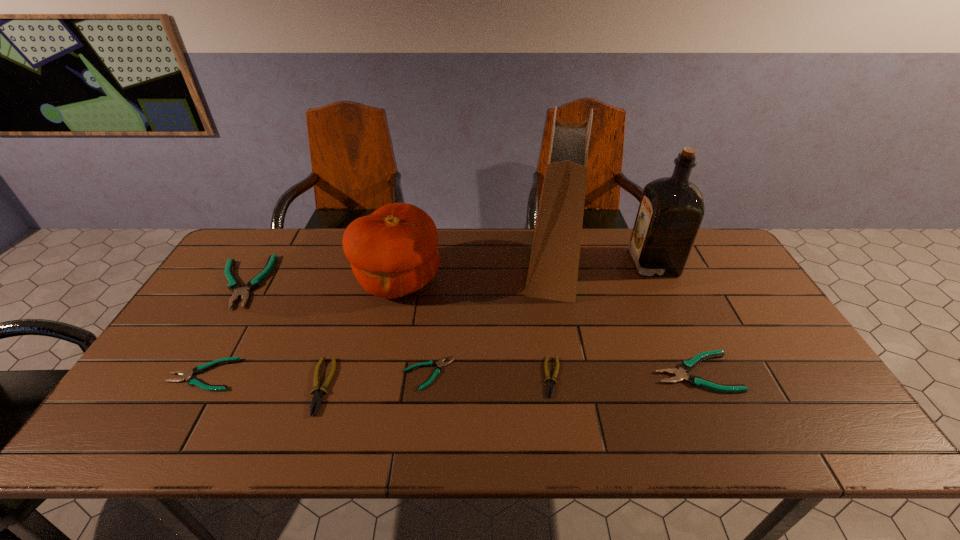
Locate an element on the screen. This screenshot has height=540, width=960. teal pliers object that ranks as the closest to the liquor is located at coordinates (680, 374).

Find the location of `teal pliers that stands as the closest to the third biggest teal pliers`. teal pliers that stands as the closest to the third biggest teal pliers is located at coordinates click(x=234, y=285).